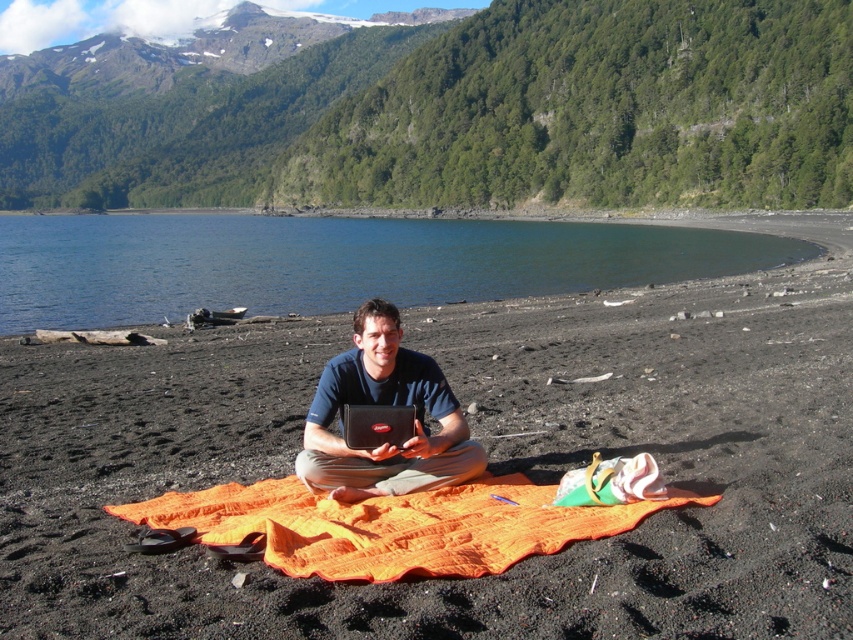
Image resolution: width=853 pixels, height=640 pixels. What do you see at coordinates (486, 467) in the screenshot?
I see `orange fabric at center` at bounding box center [486, 467].

Locate an element on the screen. orange fabric at center is located at coordinates (486, 467).

You are a GUI agent. You are given a task and a screenshot of the screen. Output one action in this format:
    pyautogui.click(x=<x>, y=<y>)
    Task: Click on the orange fabric at center
    
    Given the screenshot: What is the action you would take?
    click(486, 467)

Is blue water at center smaller than dark blue fabric at center?

No, blue water at center is not smaller than dark blue fabric at center.

Does point (515, 284) come behind point (378, 307)?

Yes, point (515, 284) is farther from viewer.

The image size is (853, 640). I want to click on blue water at center, so click(x=334, y=262).

In the scene shown: Can you confirm if orange woven blanket at center is positioned above dark blue fabric at center?

Incorrect, orange woven blanket at center is not positioned above dark blue fabric at center.

Does orange woven blanket at center appear under dark blue fabric at center?

Correct, orange woven blanket at center is located below dark blue fabric at center.

Who is more forward, (122, 508) or (332, 449)?

Positioned in front is point (332, 449).

I want to click on orange woven blanket at center, so click(395, 525).